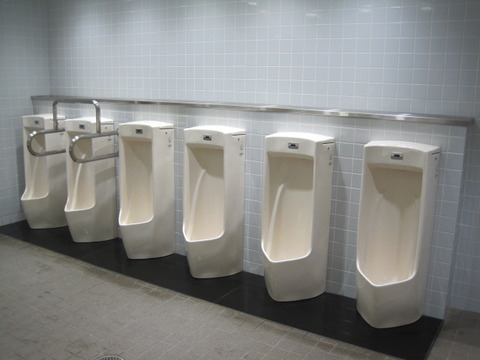
This screenshot has height=360, width=480. In order to click on urinals in this screenshot , I will do `click(389, 243)`, `click(302, 210)`, `click(210, 208)`, `click(152, 194)`, `click(91, 194)`, `click(42, 182)`.